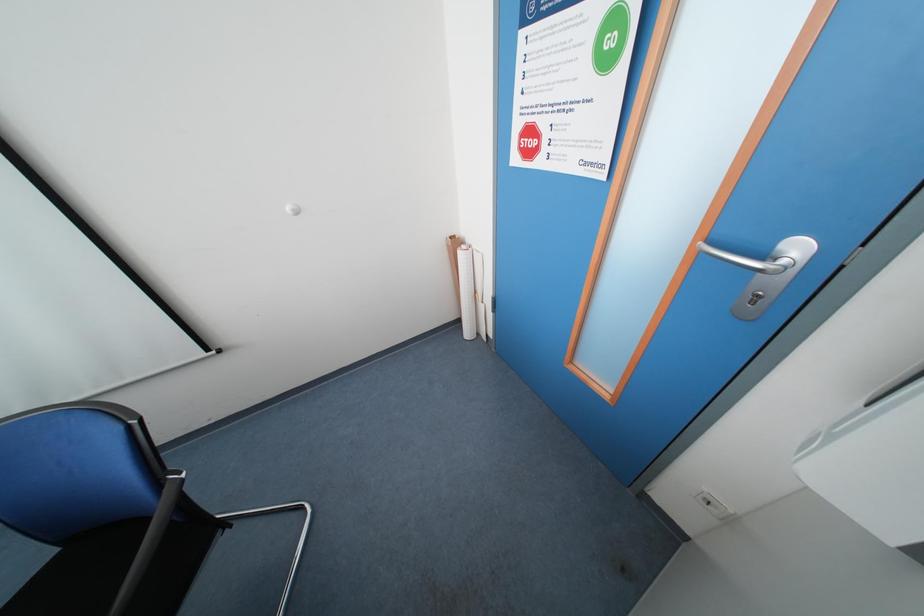
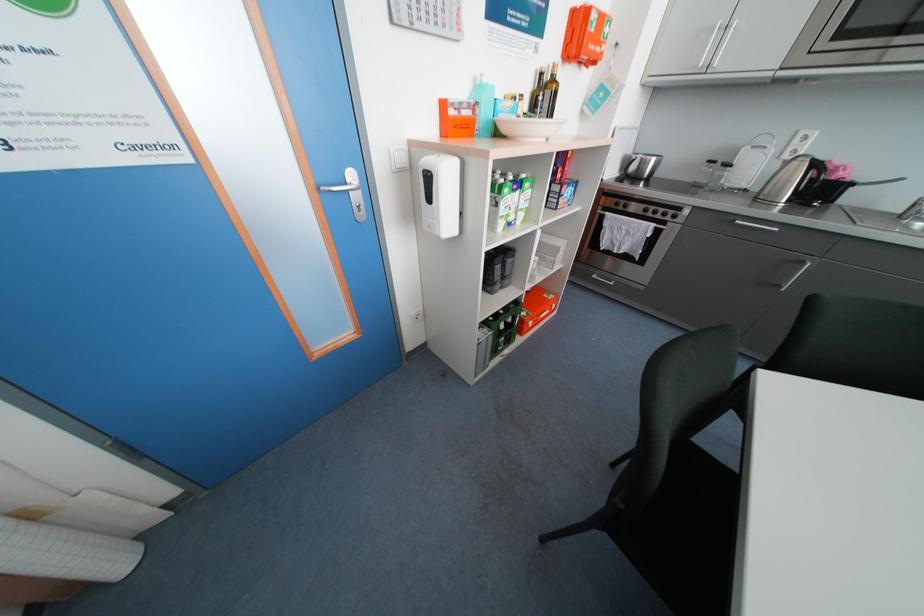
The images are taken continuously from a first-person perspective. In which direction is your viewpoint rotating?

The camera rotated toward right-down.